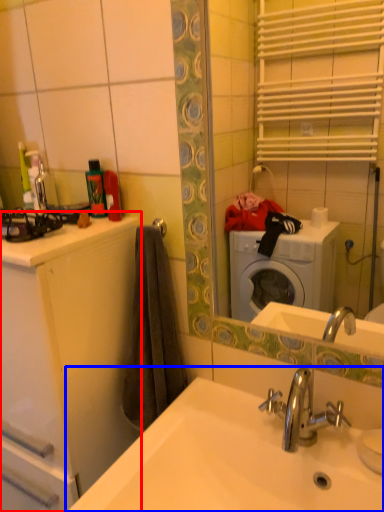
Question: Which of the following is the farthest to the observer, bathroom cabinet (highlighted by a red box) or sink (highlighted by a blue box)?

Choices:
 (A) bathroom cabinet
 (B) sink

Answer: (A)